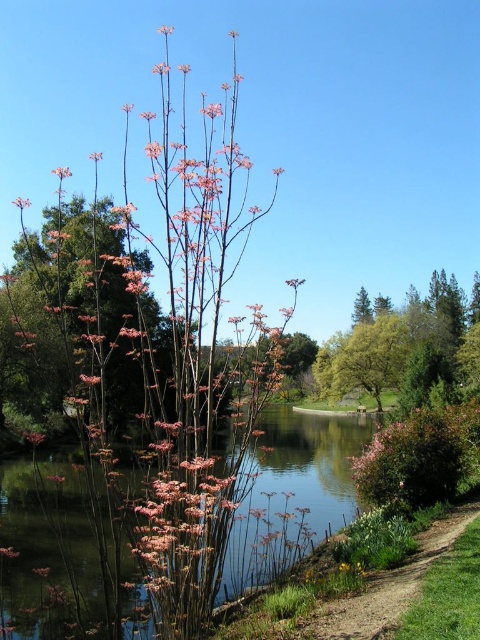
Is clear water at center taller than pink matte flower at upper center?

No, clear water at center is not taller than pink matte flower at upper center.

Is clear water at center bigger than pink matte flower at upper center?

Actually, clear water at center might be smaller than pink matte flower at upper center.

Who is more forward, (351, 502) or (164, 28)?

Point (351, 502) is in front.

You are a GUI agent. You are given a task and a screenshot of the screen. Output one action in this format:
    pyautogui.click(x=<x>, y=<y>)
    Task: Click on the clear water at center
    The image size is (480, 640).
    Given the screenshot: What is the action you would take?
    pyautogui.click(x=294, y=490)